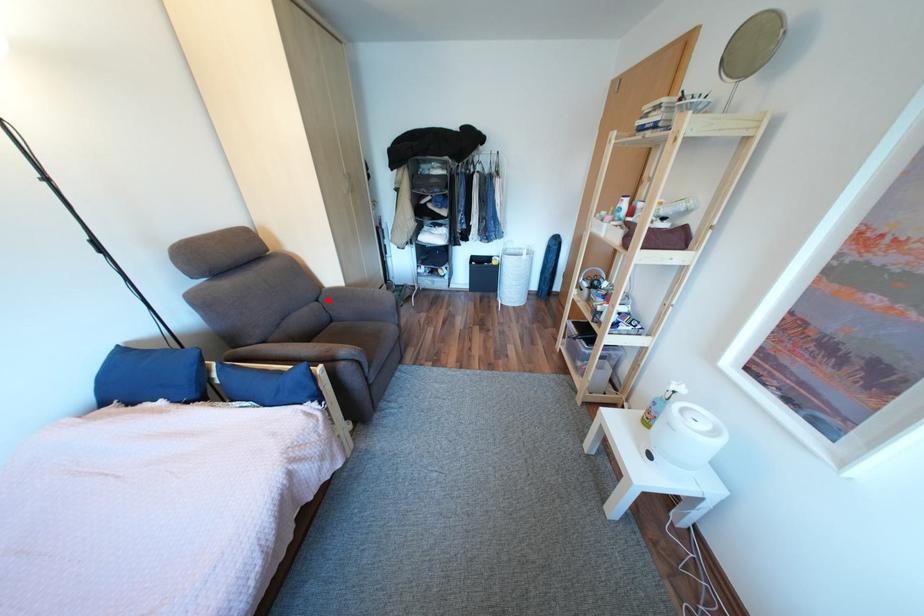
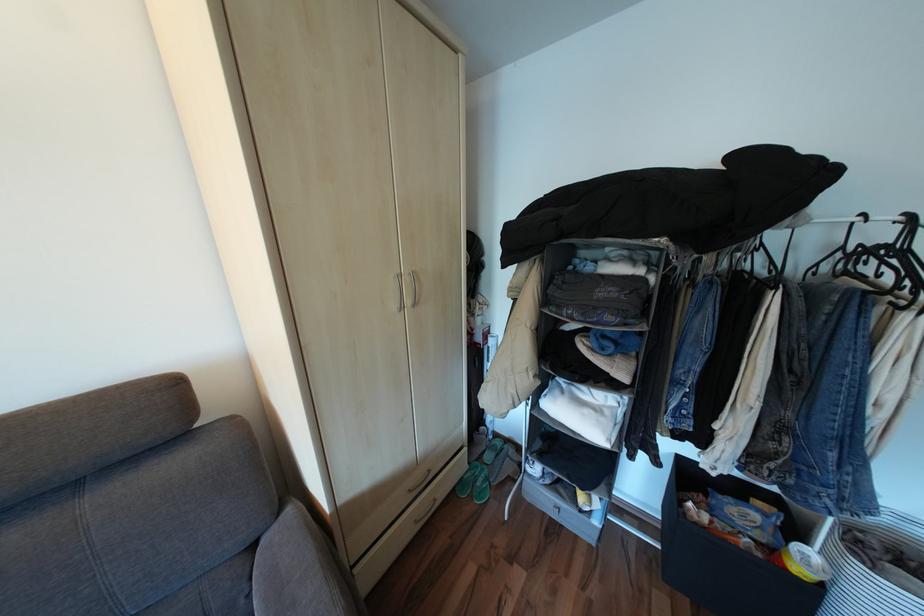
Where in the second image is the point corresponding to the highlighted location from the first image?

(263, 545)